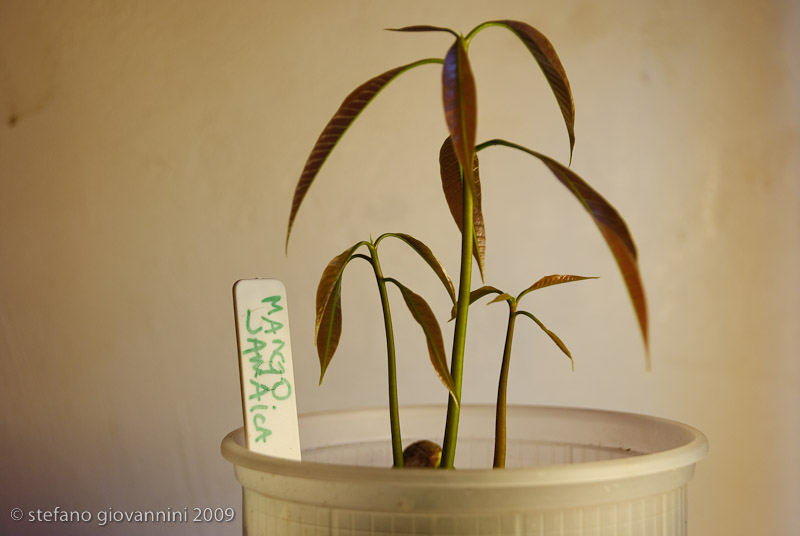
Where is `pot`? This screenshot has width=800, height=536. pot is located at coordinates (602, 505).